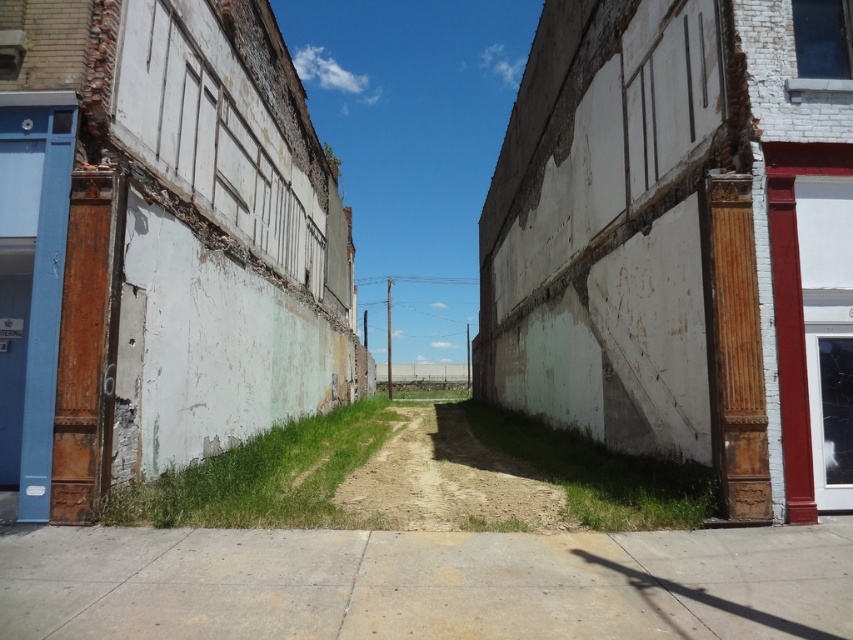
Does concrete sidewalk at center have a greater height compared to brown sandy dirt track at center?

No, concrete sidewalk at center is not taller than brown sandy dirt track at center.

Is concrete sidewalk at center thinner than brown sandy dirt track at center?

Yes.

At what (x,y) coordinates should I click in order to perform the action: click on concrete sidewalk at center. Please return your answer as a coordinate pair (x, y). The height and width of the screenshot is (640, 853). Looking at the image, I should click on point(426,584).